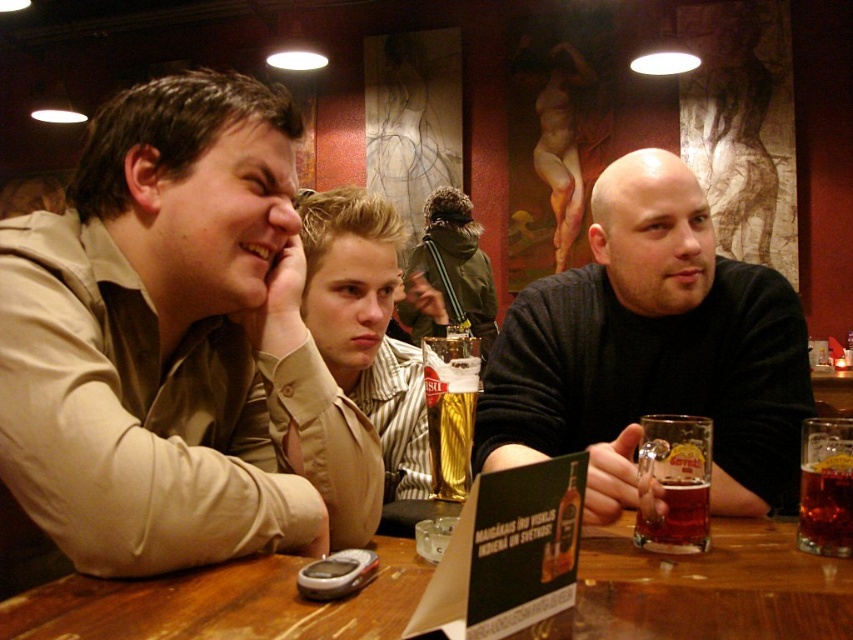
You are a photographer setting up for a group photo. You notice the matte khaki shirt at left and the translucent amber glass mug at right in the scene. Which object should you focus on first if you want to capture both in a single shot without adjusting your camera settings? Explain your reasoning based on their sizes.

You should focus on the matte khaki shirt at left first because it is larger than the translucent amber glass mug at right. Larger objects require more precise focus to ensure clarity, so starting with the larger object ensures both will be in focus when positioned correctly within the frame.

You are a waiter holding a tray of drinks. You need to place a new drink on the table between the matte khaki shirt at left and the translucent amber glass mug at right. The drink you are holding is 4 inches in diameter. Is there enough space to place it without touching either the shirt or the mug?

The distance between the matte khaki shirt at left and the translucent amber glass mug at right is 18.16 inches. The drink you want to place is 4 inches in diameter. Since 4 inches is less than 18.16 inches, there is sufficient space to place the drink between them without touching either object.